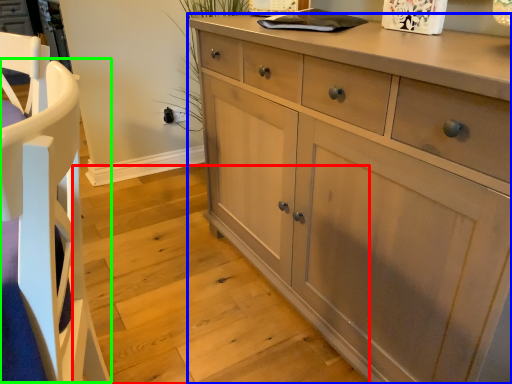
Question: Considering the real-world distances, which object is farthest from stair (highlighted by a red box)? chest of drawers (highlighted by a blue box) or armchair (highlighted by a green box)?

Choices:
 (A) chest of drawers
 (B) armchair

Answer: (B)